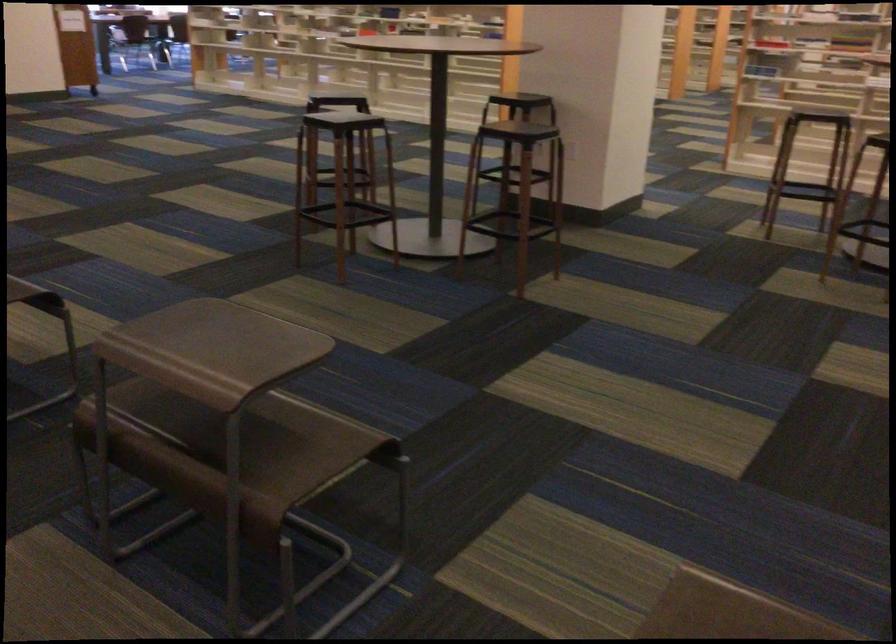
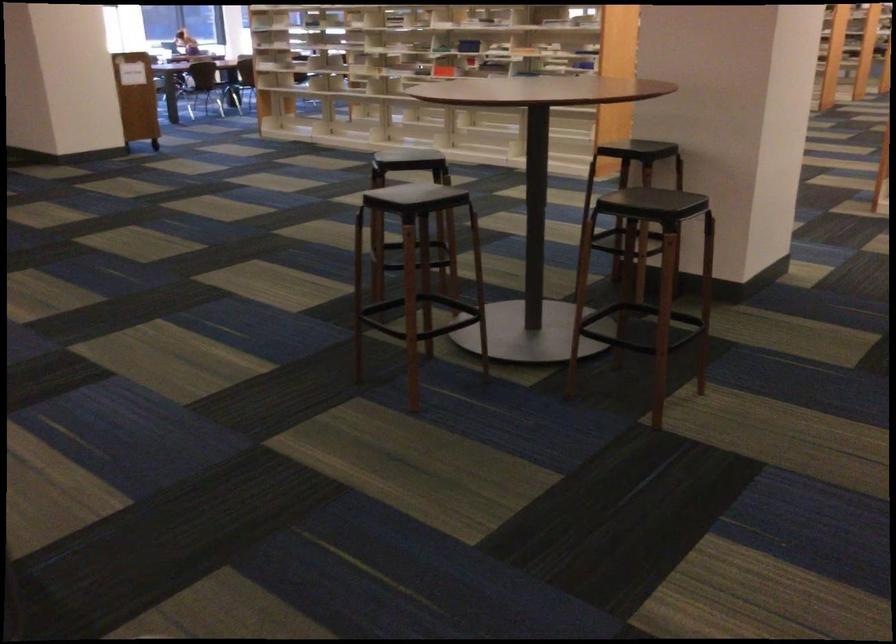
Question: The images are taken continuously from a first-person perspective. In which direction are you moving?

Choices:
 (A) Left
 (B) Right
 (C) Forward
 (D) Backward

Answer: (C)